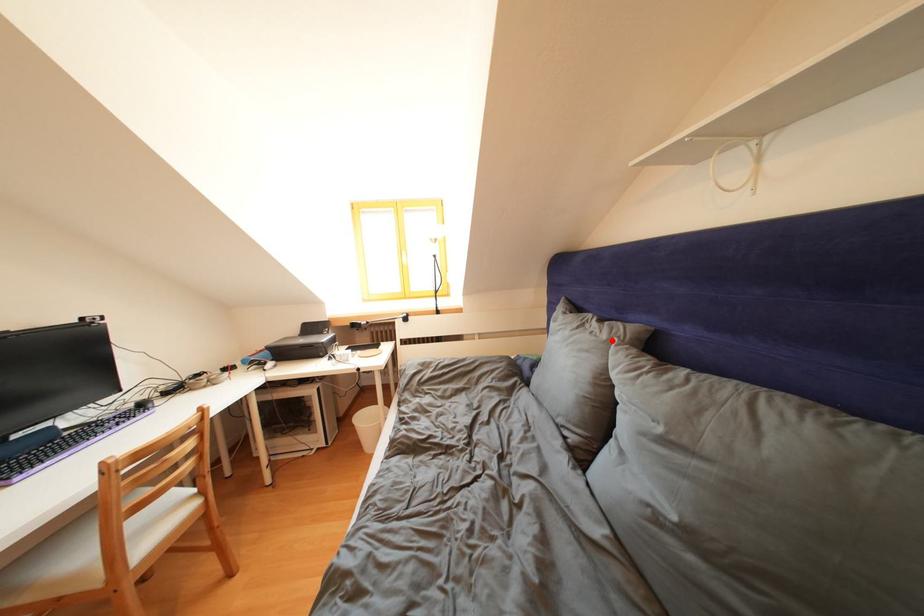
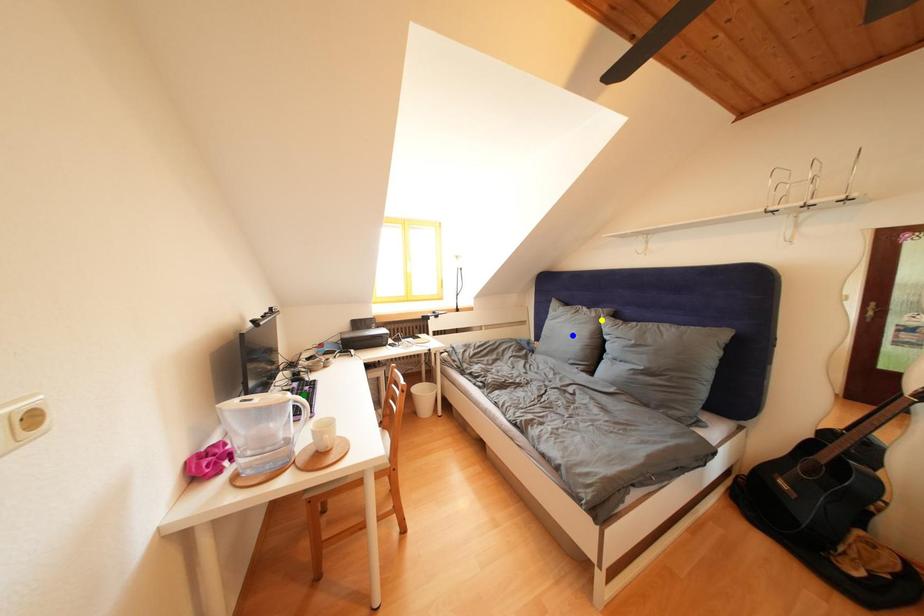
Question: I am providing you with two images of the same scene from different viewpoints. A red point is marked on the first image. You are given multiple points on the second image. Which point in image 2 represents the same 3d spot as the red point in image 1?

Choices:
 (A) green point
 (B) yellow point
 (C) blue point

Answer: (B)